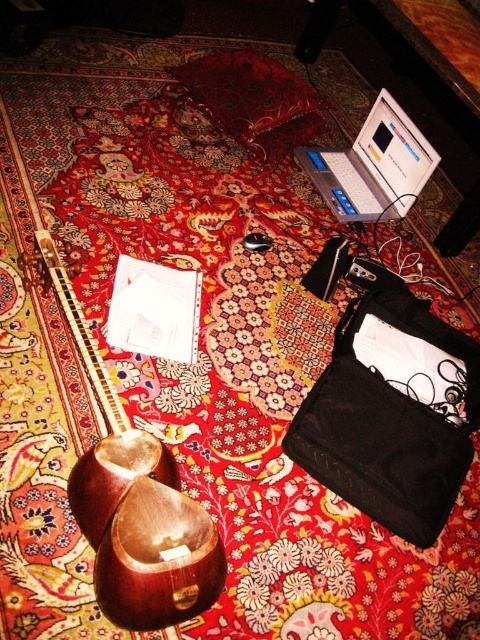
Which is behind, point (402, 410) or point (395, 154)?

Positioned behind is point (395, 154).

Can you confirm if black fabric bag at lower right is smaller than silver metallic laptop at upper right?

Actually, black fabric bag at lower right might be larger than silver metallic laptop at upper right.

You are a GUI agent. You are given a task and a screenshot of the screen. Output one action in this format:
    pyautogui.click(x=<x>, y=<y>)
    Task: Click on the black fabric bag at lower right
    
    Given the screenshot: What is the action you would take?
    pyautogui.click(x=392, y=419)

At what (x,y) coordinates should I click in order to perform the action: click on black fabric bag at lower right. Please return your answer as a coordinate pair (x, y). Image resolution: width=480 pixels, height=640 pixels. Looking at the image, I should click on (392, 419).

Does point (59, 278) lie in front of point (385, 96)?

Yes, point (59, 278) is closer to viewer.

Is wooden stringed instrument at lower left smaller than silver metallic laptop at upper right?

No, wooden stringed instrument at lower left is not smaller than silver metallic laptop at upper right.

Between point (172, 522) and point (398, 157), which one is positioned in front?

Point (172, 522) is more forward.

Where is `wooden stringed instrument at lower left`? This screenshot has width=480, height=640. wooden stringed instrument at lower left is located at coordinates point(134,502).

Between point (453, 493) and point (104, 544), which one is positioned behind?

The point (453, 493) is behind.

The width and height of the screenshot is (480, 640). Find the location of `black fabric bag at lower right`. black fabric bag at lower right is located at coordinates (392, 419).

What do you see at coordinates (392, 419) in the screenshot?
I see `black fabric bag at lower right` at bounding box center [392, 419].

Find the location of a particular element. black fabric bag at lower right is located at coordinates (392, 419).